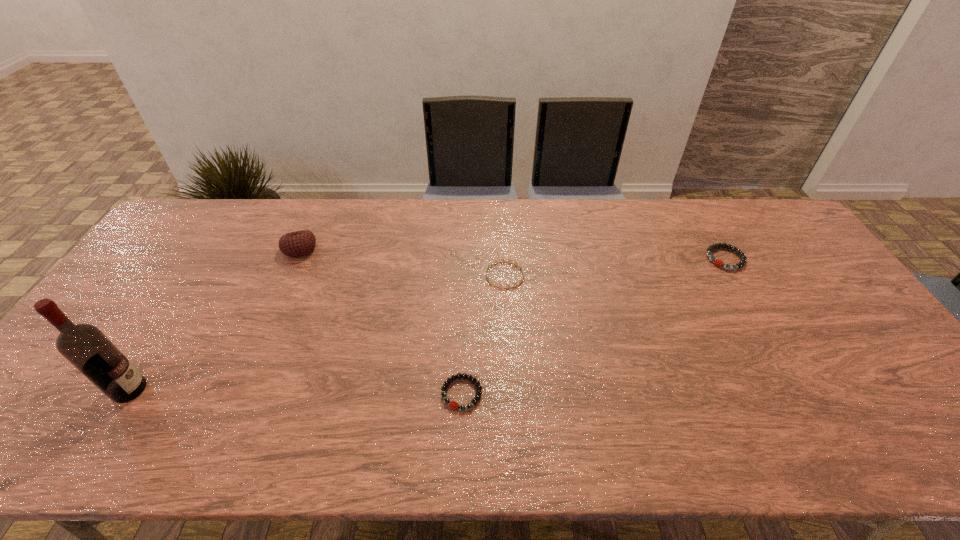
You are a GUI agent. You are given a task and a screenshot of the screen. Output one action in this format:
    pyautogui.click(x=<x>, y=<y>)
    Task: Click on the leftmost object
    The image size is (960, 540).
    Given the screenshot: What is the action you would take?
    pyautogui.click(x=85, y=346)

You are a GUI agent. You are given a task and a screenshot of the screen. Output one action in this format:
    pyautogui.click(x=<x>, y=<y>)
    Task: Click on the alcohol
    
    Given the screenshot: What is the action you would take?
    pyautogui.click(x=85, y=346)

This screenshot has height=540, width=960. Identify the location of the second object from left to right. (298, 243).

Where is `the second tallest object`? the second tallest object is located at coordinates (298, 243).

The image size is (960, 540). In order to click on the tallest bracelet in this screenshot , I will do `click(743, 259)`.

The image size is (960, 540). Identify the location of the third tallest object. (743, 259).

This screenshot has width=960, height=540. What are the coordinates of `the second bracelet from left to right` in the screenshot? It's located at (496, 261).

I want to click on the third object from left to right, so tap(454, 405).

What are the coordinates of `the nearest bracelet` in the screenshot? It's located at (454, 405).

Locate an element on the screen. The image size is (960, 540). vacant region located 0.120m on the front and back of the alcohol is located at coordinates (196, 390).